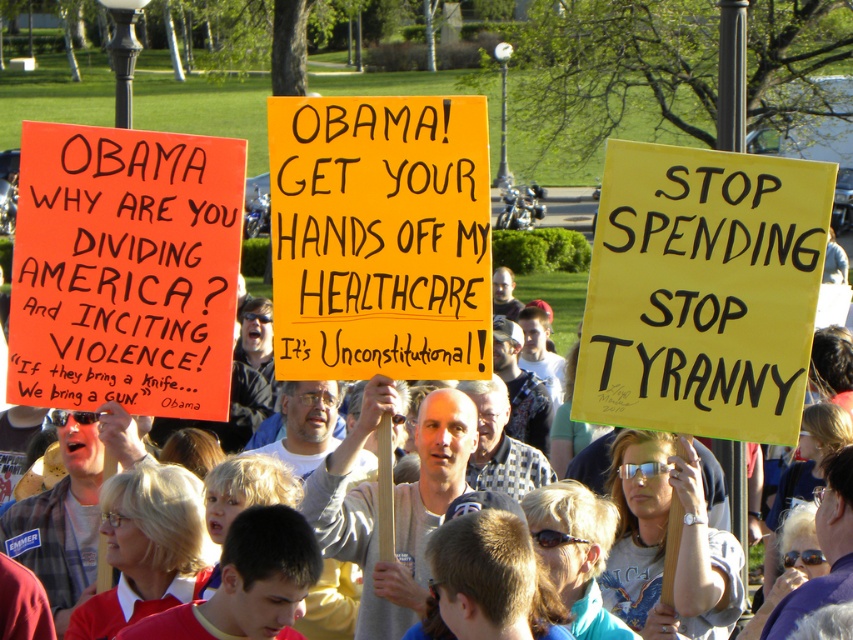
Question: Which object appears closest to the camera in this image?

Choices:
 (A) orange cardboard sign at left
 (B) yellow paper sign at right

Answer: (B)

Question: Does yellow paper sign at right appear on the left side of orange cardboard sign at left?

Choices:
 (A) no
 (B) yes

Answer: (A)

Question: Does yellow paper sign at right appear on the right side of orange paper sign at center?

Choices:
 (A) yes
 (B) no

Answer: (A)

Question: Is orange cardboard sign at left bigger than orange paper sign at center?

Choices:
 (A) yes
 (B) no

Answer: (B)

Question: Considering the real-world distances, which object is closest to the orange paper sign at center?

Choices:
 (A) yellow paper sign at right
 (B) orange cardboard sign at left

Answer: (A)

Question: Which point is farther to the camera?

Choices:
 (A) (370, 294)
 (B) (720, 362)
 (C) (80, 288)

Answer: (C)